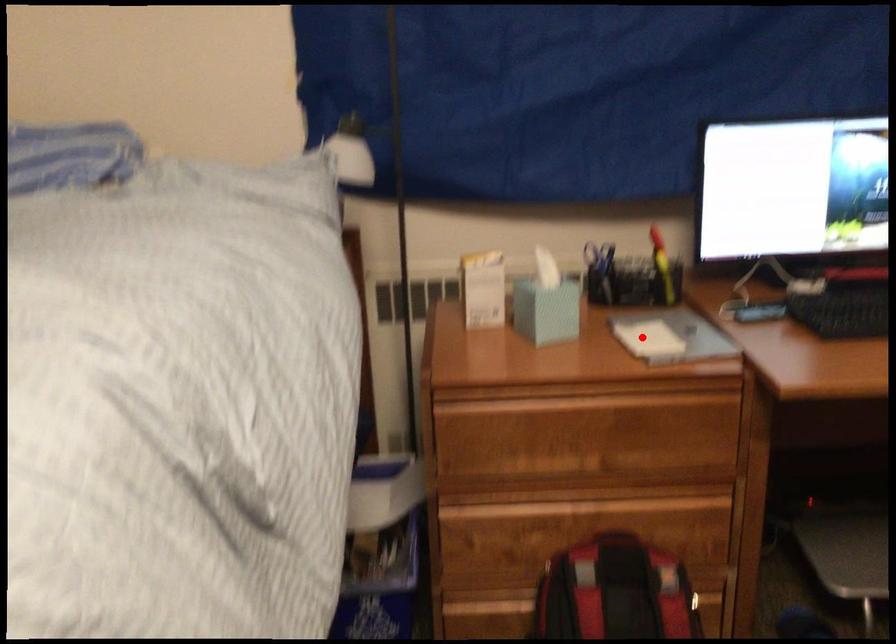
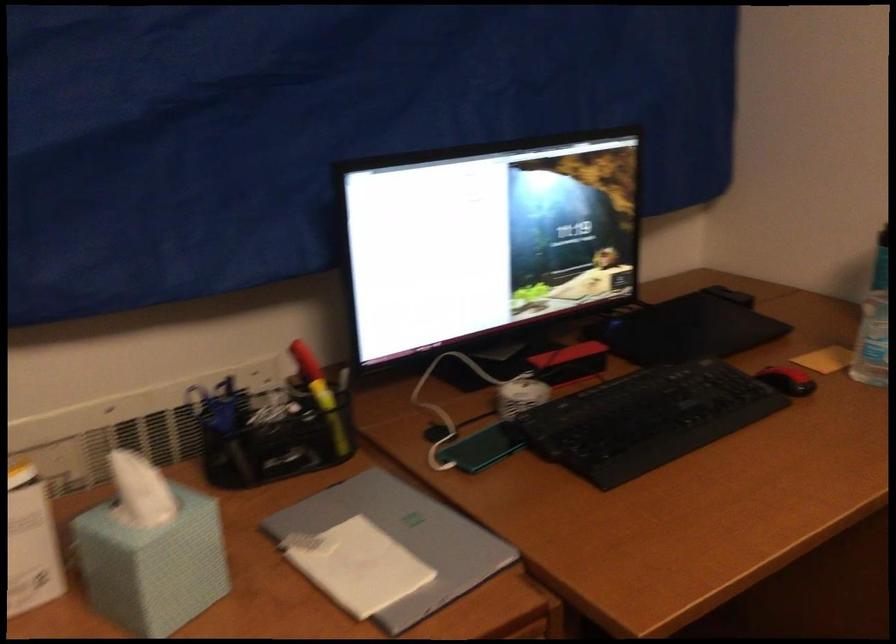
Question: I am providing you with two images of the same scene from different viewpoints. Given a red point in image1, look at the same physical point in image2. Is it:

Choices:
 (A) Closer to the viewpoint
 (B) Farther from the viewpoint

Answer: (A)